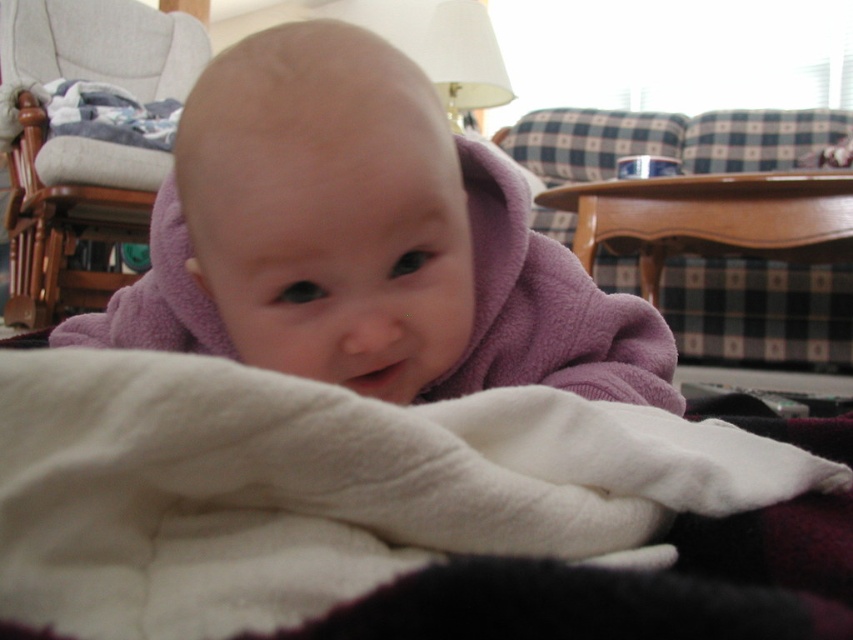
What is located at the point with coordinates (323,488) in the image?

The point with coordinates (323,488) corresponds to the white fleece blanket at center.

What is the location of the point with coordinates (323, 488) in the image?

The point with coordinates (323, 488) is located on the white fleece blanket at center.